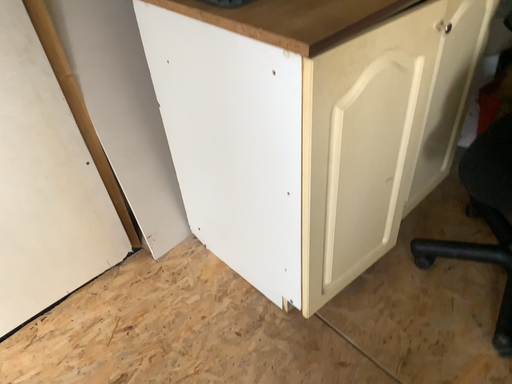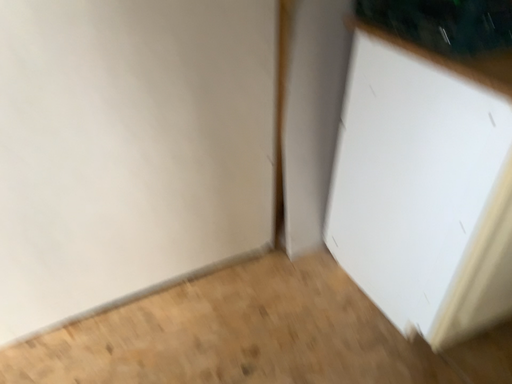
Question: Which way did the camera rotate in the video?

Choices:
 (A) rotated left
 (B) rotated right

Answer: (A)